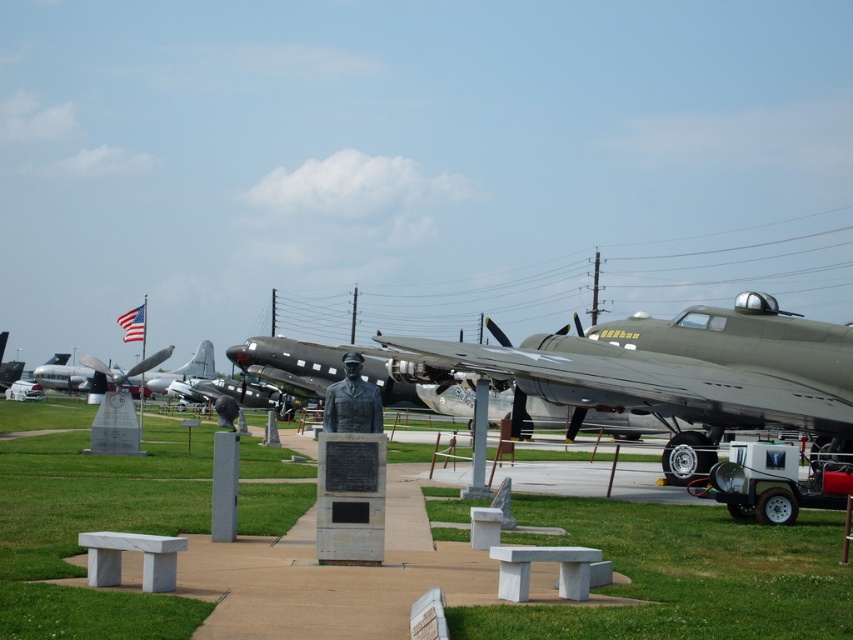
In the scene shown: You are a photographer planning to take a wide shot of the bronze statue at center and the silver metallic airplane at center. Which object will appear narrower in the photo?

The bronze statue at center will appear narrower in the photo because it is thinner than the silver metallic airplane at center.